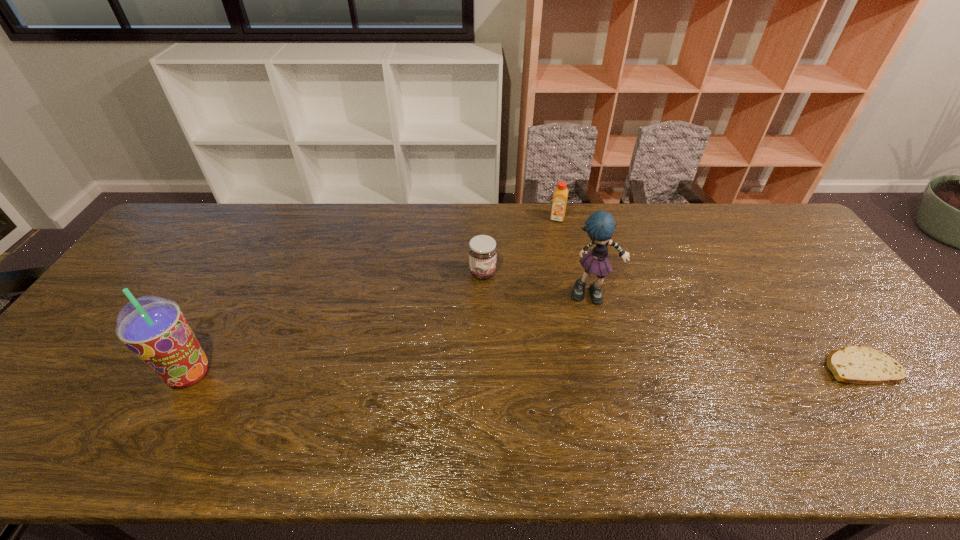
Identify the location of vacant space that satisfies the following two spatial constraints: 1. on the back side of the second shortest object; 2. on the left side of the smoothie. (246, 273).

Find the location of a particular element. vacant point that satisfies the following two spatial constraints: 1. on the back side of the smoothie; 2. on the left side of the fourth tallest object is located at coordinates (246, 273).

Where is `vacant region that satisfies the following two spatial constraints: 1. on the back side of the leftmost object; 2. on the left side of the second farthest object`? The height and width of the screenshot is (540, 960). vacant region that satisfies the following two spatial constraints: 1. on the back side of the leftmost object; 2. on the left side of the second farthest object is located at coordinates (246, 273).